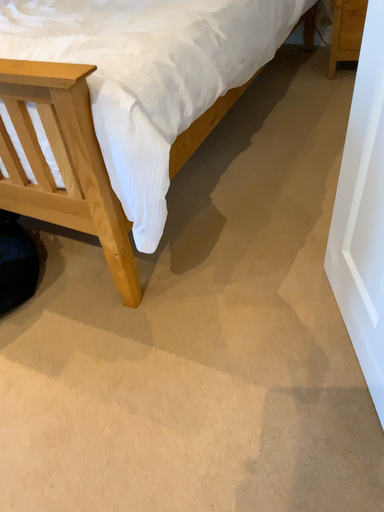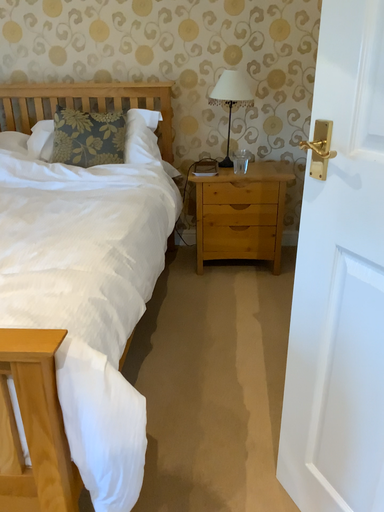
Question: Which way did the camera rotate in the video?

Choices:
 (A) rotated right
 (B) rotated left

Answer: (A)